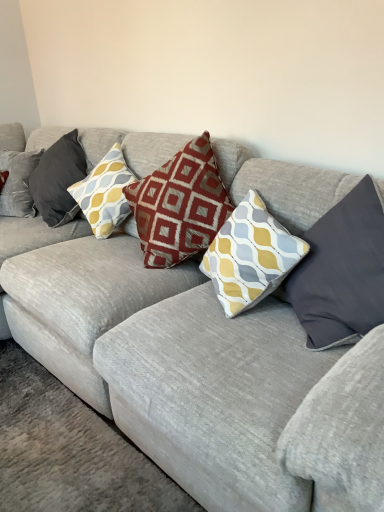
Question: Does red textured pillow at center, placed as the second pillow when sorted from left to right, have a greater width compared to maroon fabric pillow at center, marked as the third pillow in a right-to-left arrangement?

Choices:
 (A) no
 (B) yes

Answer: (A)

Question: Is red textured pillow at center, placed as the second pillow when sorted from left to right, to the left of maroon fabric pillow at center, marked as the third pillow in a right-to-left arrangement, from the viewer's perspective?

Choices:
 (A) no
 (B) yes

Answer: (B)

Question: Does red textured pillow at center, placed as the second pillow when sorted from left to right, lie in front of maroon fabric pillow at center, marked as the third pillow in a left-to-right arrangement?

Choices:
 (A) yes
 (B) no

Answer: (B)

Question: From a real-world perspective, is red textured pillow at center, placed as the second pillow when sorted from left to right, beneath maroon fabric pillow at center, marked as the third pillow in a right-to-left arrangement?

Choices:
 (A) yes
 (B) no

Answer: (A)

Question: Does red textured pillow at center, placed as the second pillow when sorted from left to right, have a larger size compared to maroon fabric pillow at center, marked as the third pillow in a left-to-right arrangement?

Choices:
 (A) yes
 (B) no

Answer: (B)

Question: Is point (263, 257) closer or farther from the camera than point (56, 179)?

Choices:
 (A) closer
 (B) farther

Answer: (A)

Question: Is yellow and gray patterned pillow at center, the fourth pillow viewed from the left, inside the boundaries of velvet cushion at left, the 5th pillow from the right, or outside?

Choices:
 (A) inside
 (B) outside

Answer: (B)

Question: In terms of height, does yellow and gray patterned pillow at center, positioned as the 2th pillow in right-to-left order, look taller or shorter compared to velvet cushion at left, the first pillow from the left?

Choices:
 (A) tall
 (B) short

Answer: (B)

Question: Visually, is yellow and gray patterned pillow at center, positioned as the 2th pillow in right-to-left order, positioned to the left or to the right of velvet cushion at left, the first pillow from the left?

Choices:
 (A) right
 (B) left

Answer: (A)

Question: Is point (276, 248) closer or farther from the camera than point (327, 288)?

Choices:
 (A) farther
 (B) closer

Answer: (A)

Question: Relative to dark gray fabric pillow at right, the 1th pillow when ordered from right to left, is yellow and gray patterned pillow at center, positioned as the 2th pillow in right-to-left order, in front or behind?

Choices:
 (A) behind
 (B) front

Answer: (A)

Question: In terms of height, does yellow and gray patterned pillow at center, the fourth pillow viewed from the left, look taller or shorter compared to dark gray fabric pillow at right, the 5th pillow in the left-to-right sequence?

Choices:
 (A) short
 (B) tall

Answer: (A)

Question: Visually, is yellow and gray patterned pillow at center, positioned as the 2th pillow in right-to-left order, positioned to the left or to the right of dark gray fabric pillow at right, the 5th pillow in the left-to-right sequence?

Choices:
 (A) right
 (B) left

Answer: (B)

Question: Considering the positions of dark gray fabric pillow at right, the 1th pillow when ordered from right to left, and maroon fabric pillow at center, marked as the third pillow in a left-to-right arrangement, in the image, is dark gray fabric pillow at right, the 1th pillow when ordered from right to left, wider or thinner than maroon fabric pillow at center, marked as the third pillow in a left-to-right arrangement,?

Choices:
 (A) wide
 (B) thin

Answer: (B)

Question: Is dark gray fabric pillow at right, the 1th pillow when ordered from right to left, inside the boundaries of maroon fabric pillow at center, marked as the third pillow in a left-to-right arrangement, or outside?

Choices:
 (A) inside
 (B) outside

Answer: (B)